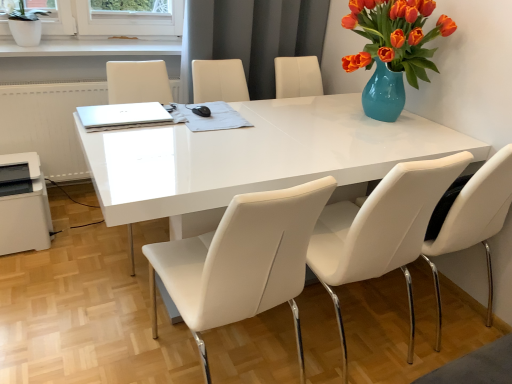
Where is `free region on the left part of white leather chair at center`? free region on the left part of white leather chair at center is located at coordinates (83, 240).